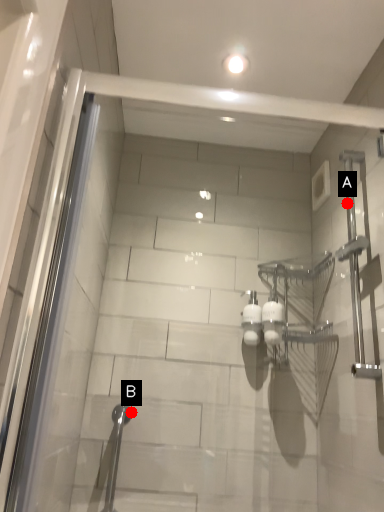
Question: Two points are circled on the image, labeled by A and B beside each circle. Among these points, which one is farthest from the camera?

Choices:
 (A) A is further
 (B) B is further

Answer: (A)